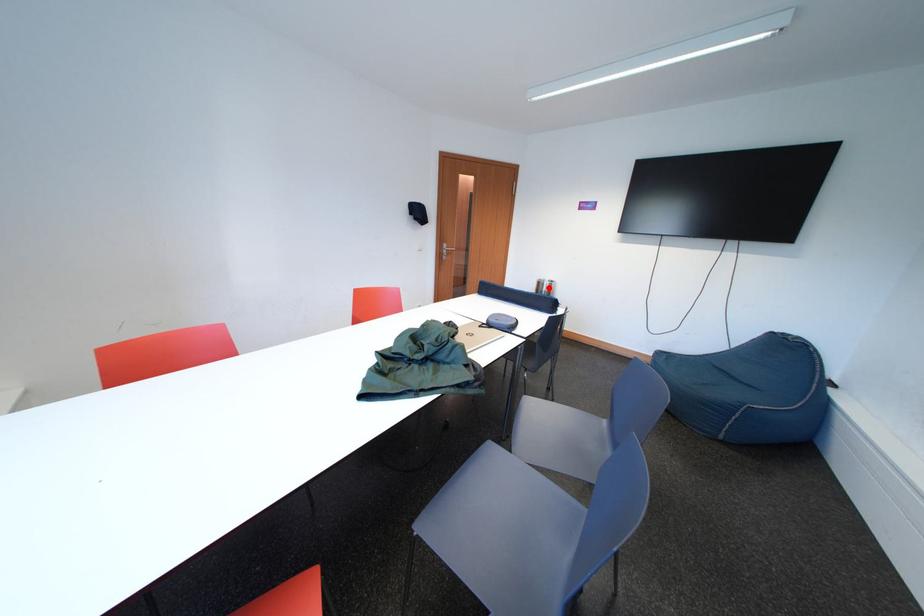
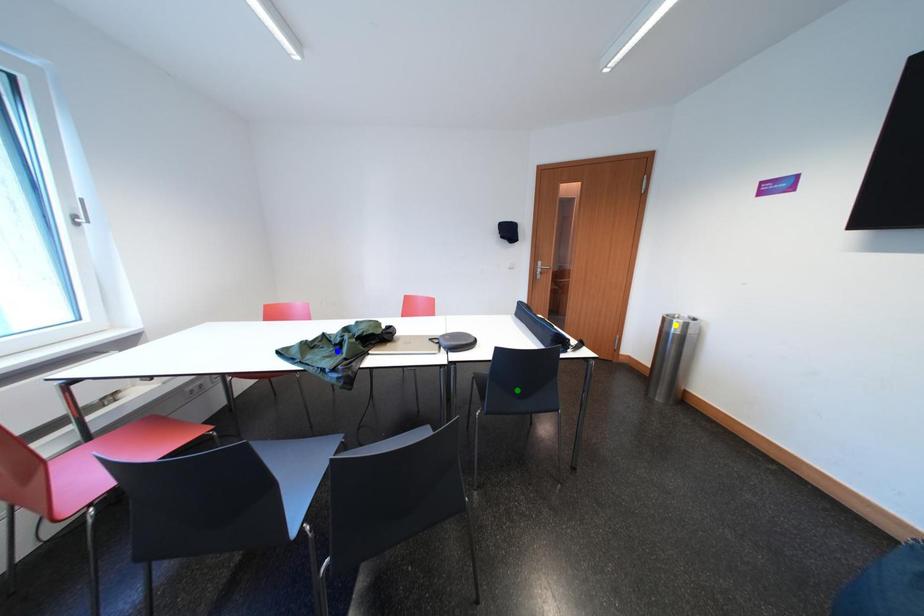
Question: I am providing you with two images of the same scene from different viewpoints. A red point is marked on the first image. You are given multiple points on the second image. Which point in image 2 is actually the same real-world point as the red point in image 1?

Choices:
 (A) blue point
 (B) green point
 (C) yellow point

Answer: (C)